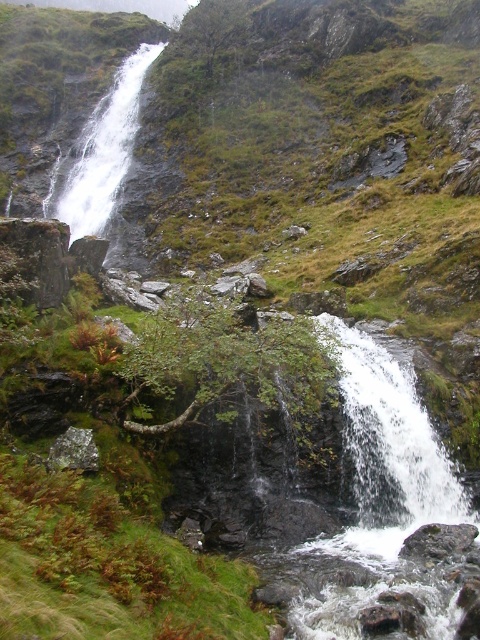
Does white frothy water at center have a lesser width compared to white frothy water at upper left?

Indeed, white frothy water at center has a lesser width compared to white frothy water at upper left.

Where is `white frothy water at center`? The width and height of the screenshot is (480, 640). white frothy water at center is located at coordinates (392, 436).

Can you confirm if gray rough rock at lower right is wider than gray lichen-covered rock at lower left?

Correct, the width of gray rough rock at lower right exceeds that of gray lichen-covered rock at lower left.

Does gray rough rock at lower right come behind gray lichen-covered rock at lower left?

That is True.

Where is `gray rough rock at lower right`? The width and height of the screenshot is (480, 640). gray rough rock at lower right is located at coordinates (439, 541).

Who is positioned more to the right, white frothy water at center or gray rough rock at lower right?

white frothy water at center is more to the right.

Does white frothy water at center appear on the right side of gray rough rock at lower right?

Yes, white frothy water at center is to the right of gray rough rock at lower right.

Locate an element on the screen. This screenshot has width=480, height=640. white frothy water at center is located at coordinates (392, 436).

The image size is (480, 640). In order to click on white frothy water at center in this screenshot , I will do `click(392, 436)`.